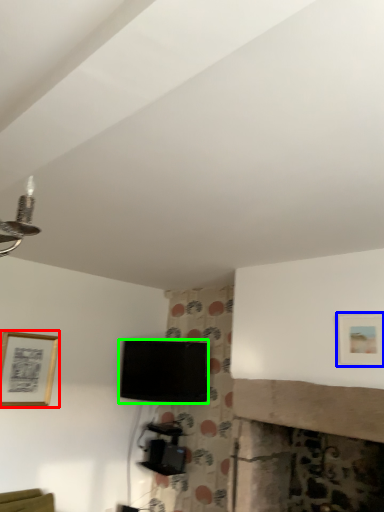
Question: Which is farther away from picture frame (highlighted by a red box)? picture frame (highlighted by a blue box) or television (highlighted by a green box)?

Choices:
 (A) picture frame
 (B) television

Answer: (A)